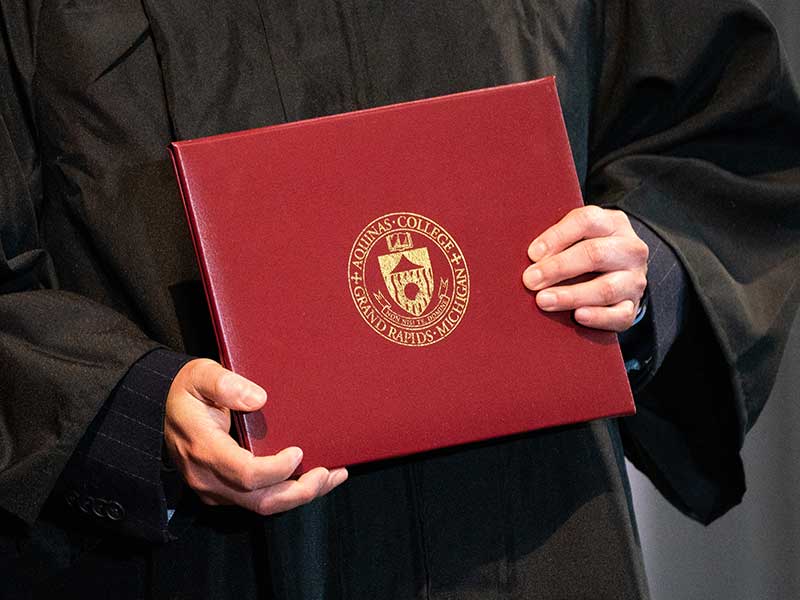
This screenshot has width=800, height=600. I want to click on chest, so [x=418, y=66].